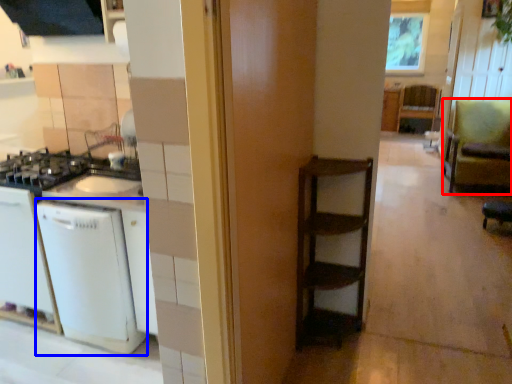
Question: Which of the following is the farthest to the observer, armchair (highlighted by a red box) or dish washer (highlighted by a blue box)?

Choices:
 (A) armchair
 (B) dish washer

Answer: (A)